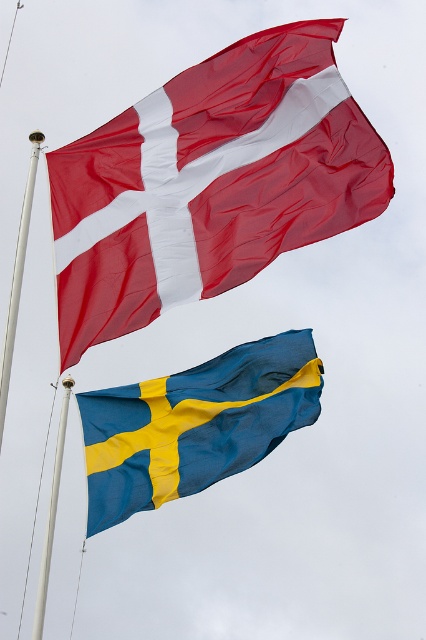
Describe the element at coordinates (195, 424) in the screenshot. I see `blue/yellow fabric flag at lower center` at that location.

The image size is (426, 640). Find the location of `blue/yellow fabric flag at lower center`. blue/yellow fabric flag at lower center is located at coordinates (195, 424).

Locate an element on the screen. The height and width of the screenshot is (640, 426). blue/yellow fabric flag at lower center is located at coordinates (195, 424).

Who is more forward, [26,227] or [46,564]?

Point [26,227] is in front.

Can you confirm if white metallic pole at upper left is taller than white metallic pole at center?

No.

Does point (13, 314) come farther from viewer compared to point (66, 400)?

No, it is in front of (66, 400).

Where is `white metallic pole at upper left`? The image size is (426, 640). white metallic pole at upper left is located at coordinates (x=17, y=276).

Can you confirm if blue/yellow fabric flag at lower center is thinner than white metallic pole at upper left?

Correct, blue/yellow fabric flag at lower center's width is less than white metallic pole at upper left's.

Is point (256, 369) closer to viewer compared to point (26, 212)?

No.

At what (x,y) coordinates should I click in order to perform the action: click on blue/yellow fabric flag at lower center. Please return your answer as a coordinate pair (x, y). This screenshot has width=426, height=640. Looking at the image, I should click on (195, 424).